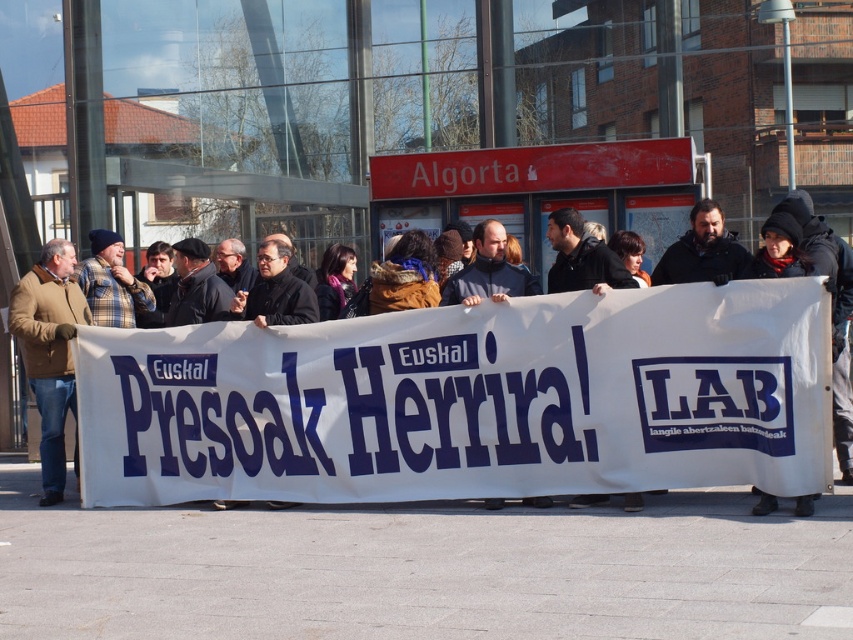
Question: Can you confirm if white paper banner at center is positioned above brown woolen jacket at left?

Choices:
 (A) yes
 (B) no

Answer: (B)

Question: Is white paper banner at center in front of brown woolen jacket at left?

Choices:
 (A) yes
 (B) no

Answer: (A)

Question: Which object is farther from the camera taking this photo?

Choices:
 (A) white paper banner at center
 (B) brown woolen jacket at left

Answer: (B)

Question: Observing the image, what is the correct spatial positioning of white paper banner at center in reference to brown woolen jacket at left?

Choices:
 (A) above
 (B) below

Answer: (B)